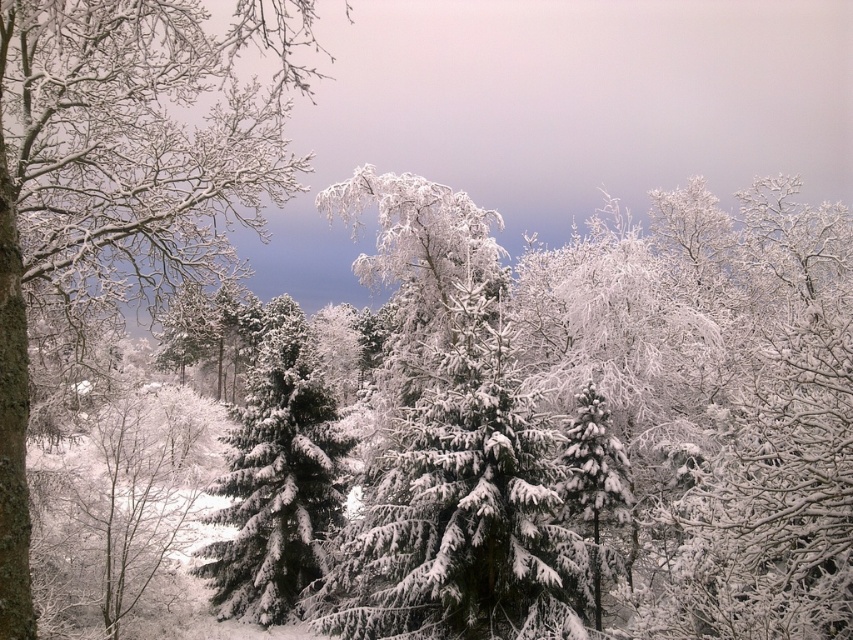
Question: Which point is closer to the camera taking this photo?

Choices:
 (A) (265, 99)
 (B) (300, 493)

Answer: (B)

Question: Which point is closer to the camera?

Choices:
 (A) snow-covered evergreen at center
 (B) snow-covered branches at left

Answer: (B)

Question: Is snow-covered branches at left positioned at the back of snow-covered evergreen at center?

Choices:
 (A) no
 (B) yes

Answer: (A)

Question: Which point appears closest to the camera in this image?

Choices:
 (A) (20, 280)
 (B) (309, 582)

Answer: (A)

Question: Is snow-covered branches at left bigger than snow-covered evergreen at center?

Choices:
 (A) yes
 (B) no

Answer: (A)

Question: From the image, what is the correct spatial relationship of snow-covered branches at left in relation to snow-covered evergreen at center?

Choices:
 (A) left
 (B) right

Answer: (A)